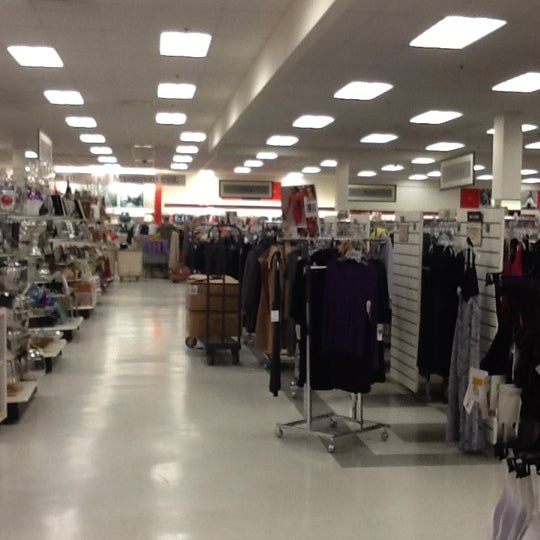
Locate an element on the screen. The height and width of the screenshot is (540, 540). cardboard box is located at coordinates (198, 300).